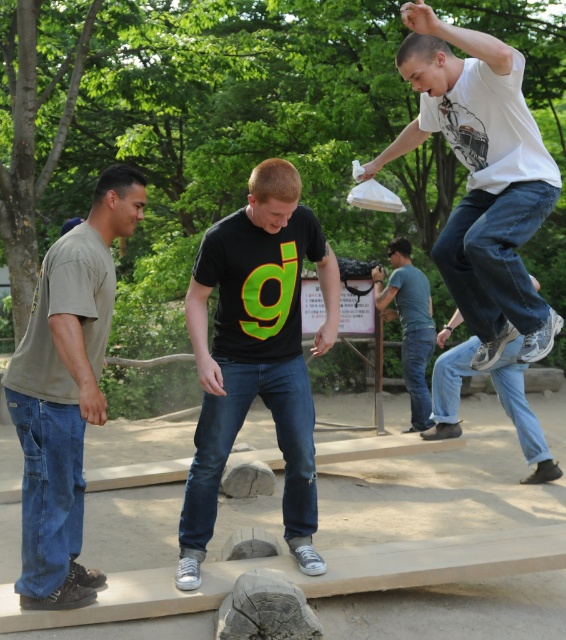
From the picture: Which of these two, black matte t-shirt at center or matte khaki t-shirt at left, stands shorter?

Standing shorter between the two is black matte t-shirt at center.

Locate an element on the screen. Image resolution: width=566 pixels, height=640 pixels. black matte t-shirt at center is located at coordinates (256, 355).

The height and width of the screenshot is (640, 566). I want to click on black matte t-shirt at center, so click(256, 355).

Is point (552, 333) farther from viewer compared to point (28, 442)?

That is True.

Looking at this image, is white matte shirt at upper right below matte khaki t-shirt at left?

No.

Where is `white matte shirt at upper right`? The image size is (566, 640). white matte shirt at upper right is located at coordinates (481, 180).

You are a GUI agent. You are given a task and a screenshot of the screen. Output one action in this format:
    pyautogui.click(x=<x>, y=<y>)
    Task: Click on the white matte shirt at upper right
    The width and height of the screenshot is (566, 640).
    Given the screenshot: What is the action you would take?
    pyautogui.click(x=481, y=180)

Which is below, matte khaki t-shirt at left or denim jeans at center?

denim jeans at center is below.

Between matte khaki t-shirt at left and denim jeans at center, which one appears on the left side from the viewer's perspective?

From the viewer's perspective, matte khaki t-shirt at left appears more on the left side.

Identify the location of matte khaki t-shirt at left. Image resolution: width=566 pixels, height=640 pixels. (66, 392).

The image size is (566, 640). Find the location of `matte khaki t-shirt at left`. matte khaki t-shirt at left is located at coordinates (66, 392).